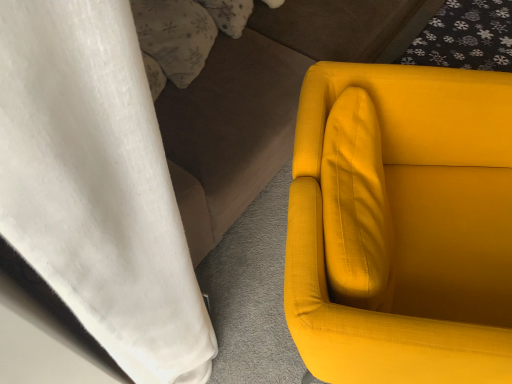
Question: From a real-world perspective, is fluffy white pillow at upper left positioned above or below matte yellow fabric chair at right?

Choices:
 (A) below
 (B) above

Answer: (B)

Question: Considering the positions of point (185, 46) and point (480, 322), is point (185, 46) closer or farther from the camera than point (480, 322)?

Choices:
 (A) farther
 (B) closer

Answer: (A)

Question: Which of these objects is positioned closest to the fluffy white pillow at upper left?

Choices:
 (A) matte yellow fabric chair at right
 (B) matte yellow fabric couch at right

Answer: (B)

Question: Estimate the real-world distances between objects in this image. Which object is farther from the matte yellow fabric chair at right?

Choices:
 (A) fluffy white pillow at upper left
 (B) matte yellow fabric couch at right

Answer: (A)